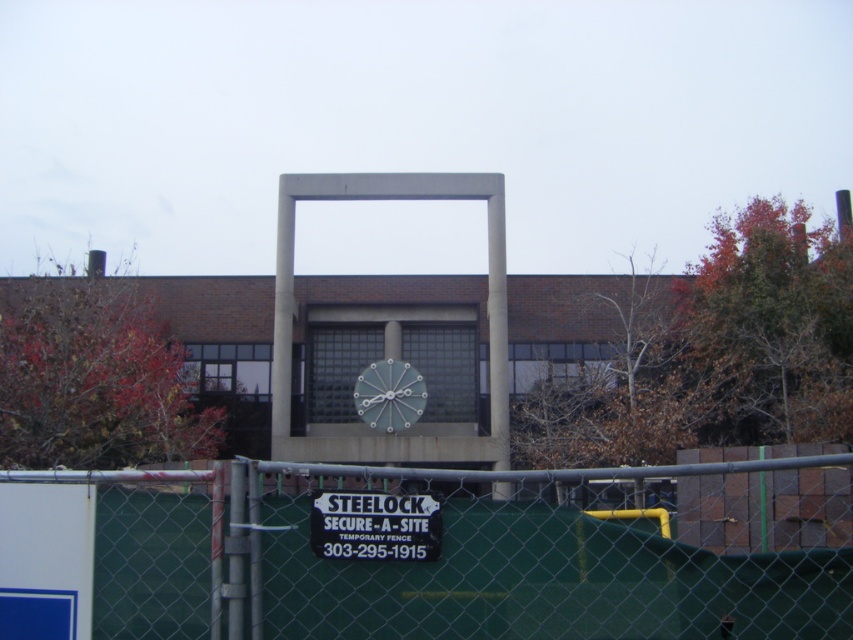
Question: Which of the following is the farthest from the observer?

Choices:
 (A) (415, 556)
 (B) (448, 477)

Answer: (B)

Question: From the image, what is the correct spatial relationship of green chain-link fence at center in relation to black plastic sign at center?

Choices:
 (A) left
 (B) right

Answer: (B)

Question: Considering the relative positions of green chain-link fence at center and black plastic sign at center in the image provided, where is green chain-link fence at center located with respect to black plastic sign at center?

Choices:
 (A) below
 (B) above

Answer: (A)

Question: Can you confirm if green chain-link fence at center is positioned below black plastic sign at center?

Choices:
 (A) yes
 (B) no

Answer: (A)

Question: Which object appears farthest from the camera in this image?

Choices:
 (A) green chain-link fence at center
 (B) black plastic sign at center

Answer: (B)